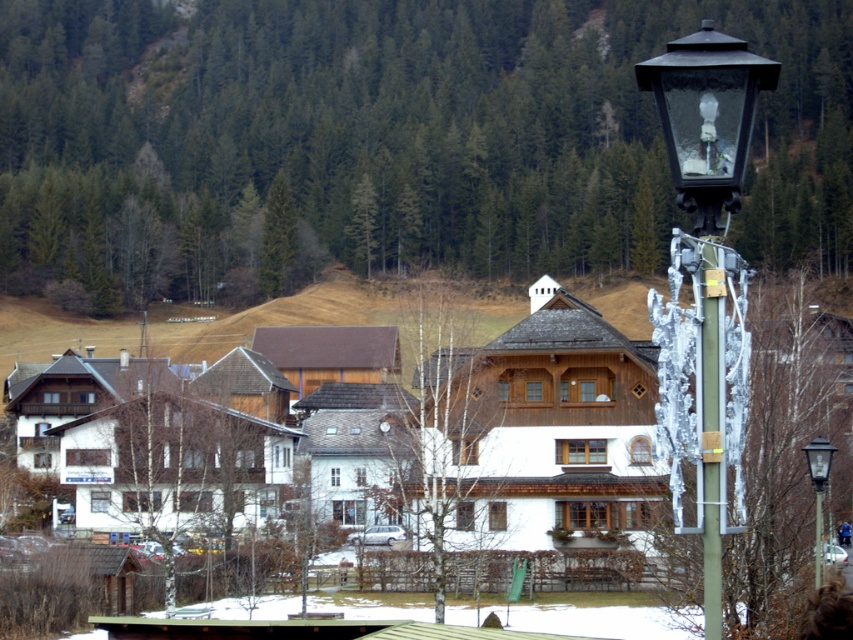
You are a visitor to the village and want to take a photo of both the white wooden houses at center and the black glass street light at upper right. However, you notice that one is blocking the view of the other. Which object is covering the other one in the image?

The white wooden houses at center is positioned over the black glass street light at upper right, so the white wooden houses at center is covering the black glass street light at upper right in the image.

You are standing at the center of the village square and want to find the black glass street light at right. According to the map coordinates, where should you look relative to your current position?

The black glass street light at right is located at coordinates point (705,285), so you should look to the right side of the village square.

Looking at the village scene, there is a lamppost with a decorative ornament and a point marked at coordinates (332, 353). What can be found at that specific coordinate location?

At point (332, 353) lies white wooden houses at center.